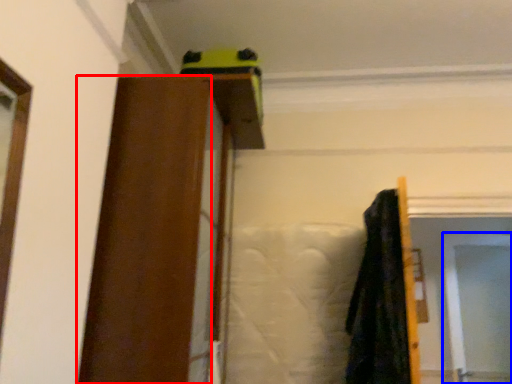
Question: Which object is closer to the camera taking this photo, barn door (highlighted by a red box) or screen door (highlighted by a blue box)?

Choices:
 (A) barn door
 (B) screen door

Answer: (A)